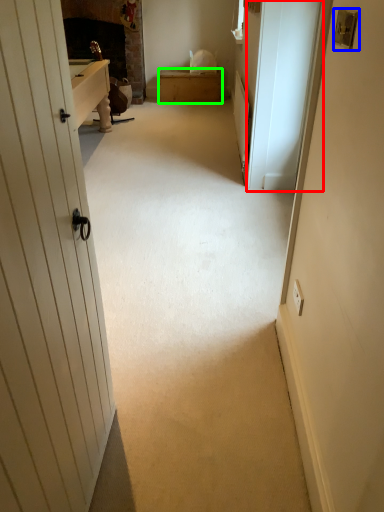
Question: Which object is the closest to the screen door (highlighted by a red box)? Choose among these: lock (highlighted by a blue box) or furniture (highlighted by a green box).

Choices:
 (A) lock
 (B) furniture

Answer: (A)